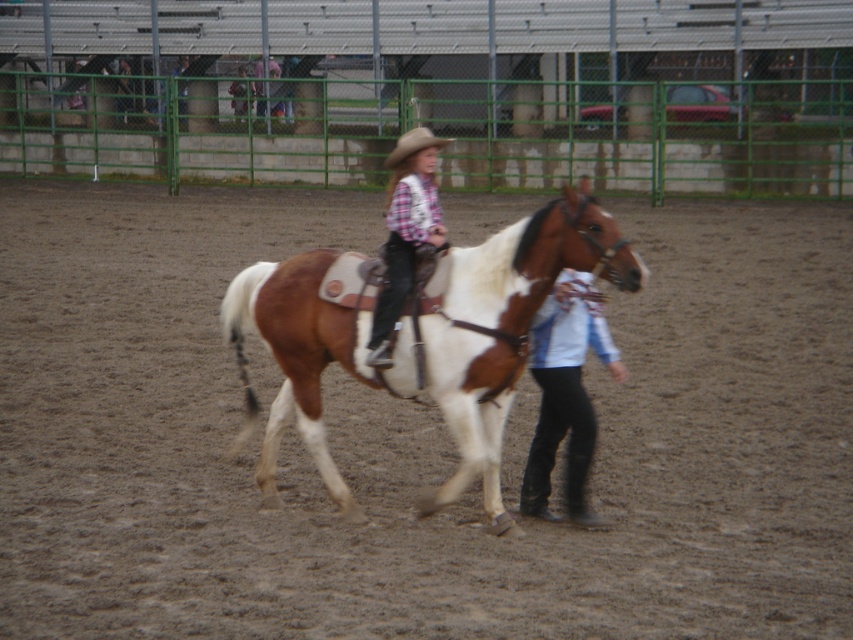
Question: Can you confirm if brown leather horse at center is positioned to the right of plaid shirt and jeans at center?

Choices:
 (A) yes
 (B) no

Answer: (A)

Question: Can you confirm if brown leather horse at center is positioned to the right of denim jacket at upper center?

Choices:
 (A) no
 (B) yes

Answer: (B)

Question: Which point is farther from the camera taking this photo?

Choices:
 (A) (265, 76)
 (B) (543, 419)
 (C) (234, 86)
 (D) (334, 342)

Answer: (A)

Question: Which point is closer to the camera?

Choices:
 (A) matte brown cowboy hat at upper center
 (B) brown leather horse at center
 (C) denim jacket at upper center
 (D) black leather pants at lower right

Answer: (B)

Question: Can you confirm if plaid shirt and jeans at center is positioned to the right of denim jacket at upper center?

Choices:
 (A) yes
 (B) no

Answer: (A)

Question: Which point is closer to the camera taking this photo?

Choices:
 (A) (593, 320)
 (B) (425, 246)
 (C) (250, 100)

Answer: (B)